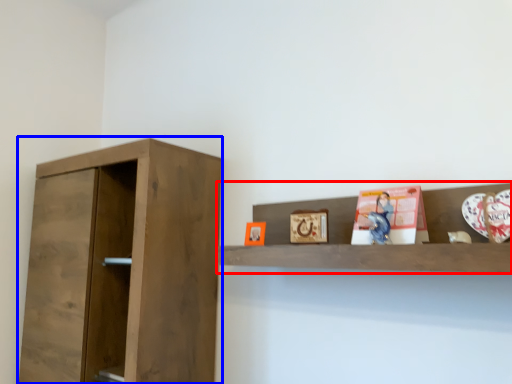
Question: Which point is further to the camera, shelf (highlighted by a red box) or cupboard (highlighted by a blue box)?

Choices:
 (A) shelf
 (B) cupboard

Answer: (B)